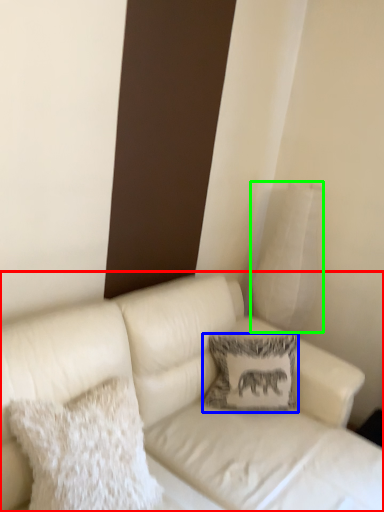
Question: Estimate the real-world distances between objects in this image. Which object is farther from studio couch (highlighted by a red box), pillow (highlighted by a blue box) or pillow (highlighted by a green box)?

Choices:
 (A) pillow
 (B) pillow

Answer: (B)